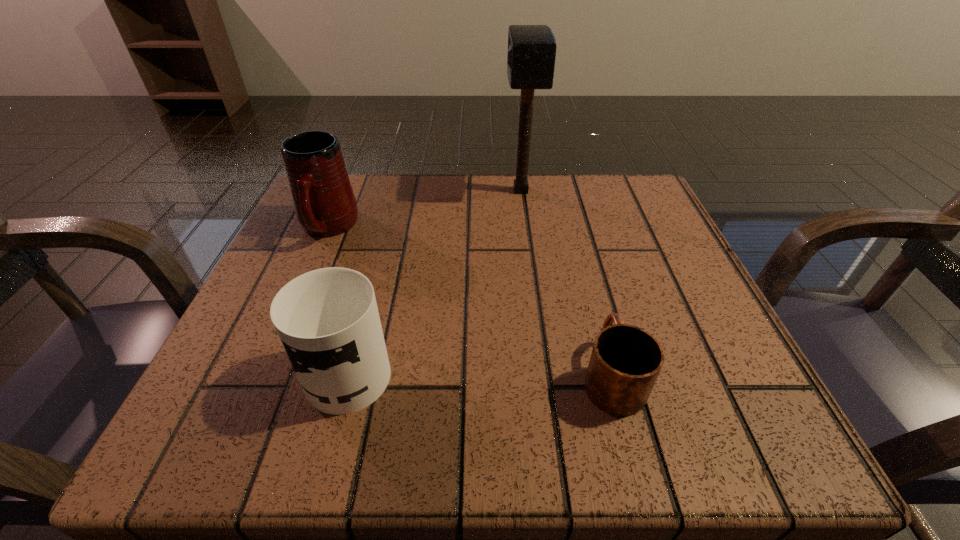
Locate an element on the screen. The height and width of the screenshot is (540, 960). free space located 0.200m on the handle side of the second object from left to right is located at coordinates (383, 245).

Identify the location of vacant space located on the handle side of the second object from left to right. Image resolution: width=960 pixels, height=540 pixels. (379, 258).

Identify the location of vacant position located 0.360m on the side of the rightmost object with the handle. (x=567, y=208).

I want to click on vacant area situated 0.080m on the side of the rightmost object with the handle, so coord(592,302).

This screenshot has height=540, width=960. What are the coordinates of `vacant space located on the side of the rightmost object with the handle` in the screenshot? It's located at (566, 203).

This screenshot has width=960, height=540. What are the coordinates of `mallet present at the far edge` in the screenshot? It's located at (531, 55).

You are a GUI agent. You are given a task and a screenshot of the screen. Output one action in this format:
    pyautogui.click(x=<x>, y=<y>)
    Task: Click on the mug located in the far edge section of the desktop
    This screenshot has width=960, height=540.
    Given the screenshot: What is the action you would take?
    pyautogui.click(x=325, y=205)

The width and height of the screenshot is (960, 540). In order to click on object at the right edge in this screenshot , I will do `click(625, 362)`.

Find the location of `object located in the far left corner section of the desktop`. object located in the far left corner section of the desktop is located at coordinates (325, 205).

The height and width of the screenshot is (540, 960). I want to click on object that is positioned at the near left corner, so click(x=327, y=319).